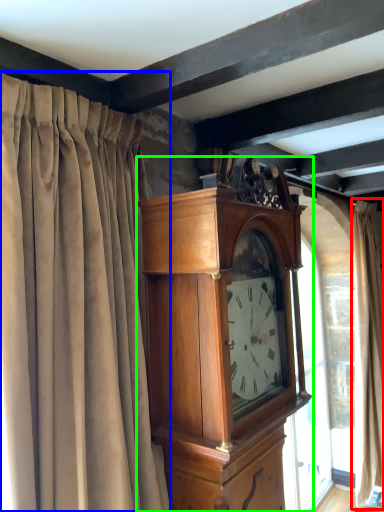
Question: Considering the real-world distances, which object is farthest from curtain (highlighted by a red box)? curtain (highlighted by a blue box) or wall clock (highlighted by a green box)?

Choices:
 (A) curtain
 (B) wall clock

Answer: (A)